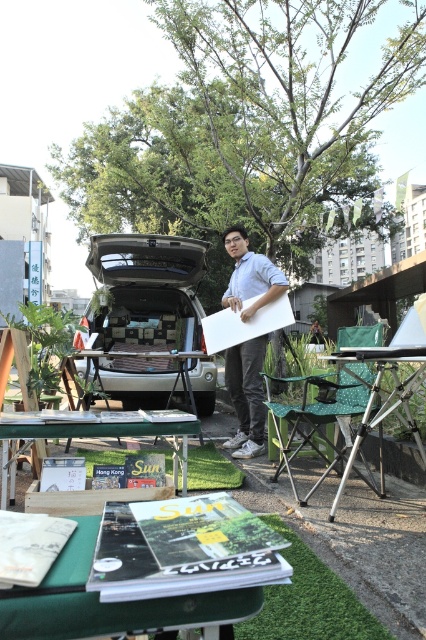
You are setting up a booth for a community event and need to place a large banner. The banner requires a surface that can support its weight. Given the matte white board at center and the metallic tripod table at lower right, which object is more suitable for this purpose based on their sizes?

The matte white board at center has a larger size compared to the metallic tripod table at lower right, making it more suitable to support the banner due to its greater surface area.

You are standing at the market and want to place a new item between the two points, point (x=68, y=545) and point (x=425, y=452). Which point should the item be closer to if you want it to be closer to the front of the scene?

The item should be placed closer to point (x=68, y=545) because it is in front of point (x=425, y=452) in the scene.